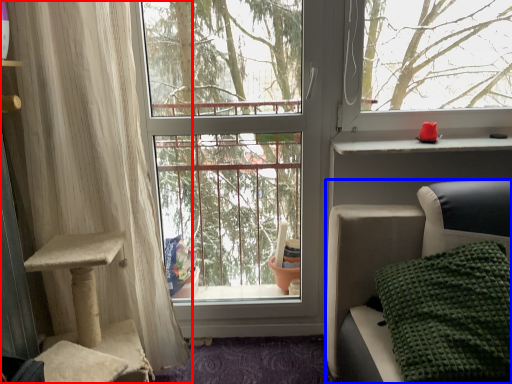
Question: Which object is further to the camera taking this photo, curtain (highlighted by a red box) or furniture (highlighted by a blue box)?

Choices:
 (A) curtain
 (B) furniture

Answer: (A)